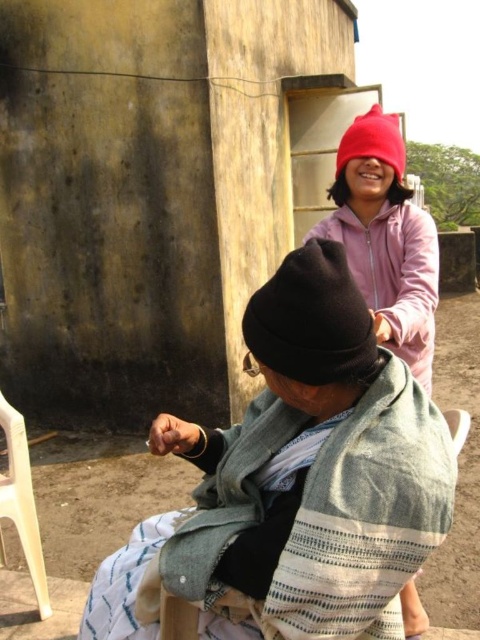
Question: Does smooth concrete wall at upper center appear on the right side of red knit hat at upper center?

Choices:
 (A) yes
 (B) no

Answer: (B)

Question: Which object is closer to the camera taking this photo?

Choices:
 (A) black woolen hat at lower center
 (B) black knit hat at center
 (C) smooth concrete wall at upper center
 (D) white plastic chair at lower left

Answer: (A)

Question: Which object is farther from the camera taking this photo?

Choices:
 (A) black woolen hat at lower center
 (B) red knit hat at upper center
 (C) pink fleece jacket at upper center

Answer: (B)

Question: Can you confirm if smooth concrete wall at upper center is positioned to the left of white plastic chair at lower left?

Choices:
 (A) yes
 (B) no

Answer: (B)

Question: Is smooth concrete wall at upper center bigger than white plastic chair at lower left?

Choices:
 (A) no
 (B) yes

Answer: (B)

Question: Which object appears farthest from the camera in this image?

Choices:
 (A) smooth concrete wall at upper center
 (B) black knit hat at center
 (C) white plastic chair at lower left

Answer: (A)